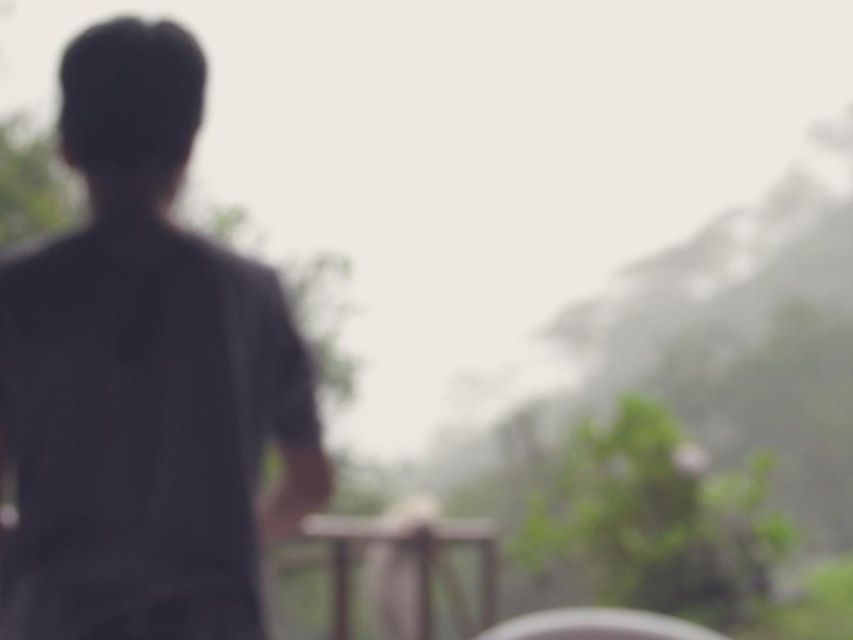
You are a photographer trying to capture a clear shot of the dark gray shirt at left and the wooden at center. Based on the scene description, which object is positioned higher in the frame?

The dark gray shirt at left is positioned above the wooden at center in the frame.

You are standing in a blurry outdoor scene with a person wearing a dark gray shirt at left. You want to touch the point at coordinates point (144, 378). Is this point on the dark gray shirt at left?

Yes, the point (144, 378) is on the dark gray shirt at left.

You are a photographer trying to capture a clear shot of the wooden at center in the blurry image. The dark gray shirt at left is obstructing your view. Can you move to the right to get a better angle? Explain why based on their positions.

The dark gray shirt at left is to the left of the wooden at center. Moving to the right might help you avoid the obstruction from the dark gray shirt at left and get a clearer view of the wooden at center.